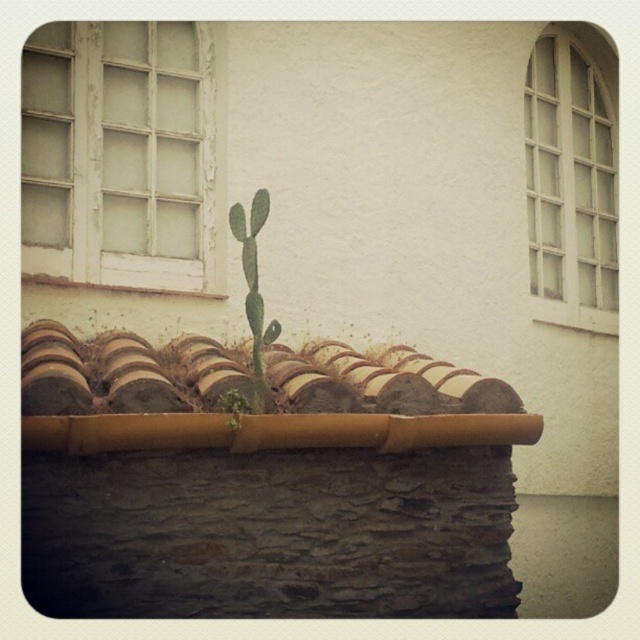
Question: Among these points, which one is farthest from the camera?

Choices:
 (A) (104, 339)
 (B) (257, 230)
 (C) (202, 68)

Answer: (C)

Question: Which of the following is the farthest from the observer?

Choices:
 (A) brown clay tiles at center
 (B) green spiky cactus at center
 (C) white wooden window at upper left
 (D) white wooden grid at upper right

Answer: (D)

Question: Does white wooden window at upper left have a larger size compared to green spiny cactus at center?

Choices:
 (A) no
 (B) yes

Answer: (B)

Question: Which object appears closest to the camera in this image?

Choices:
 (A) green spiny cactus at center
 (B) green spiky cactus at center
 (C) white wooden grid at upper right

Answer: (B)

Question: Where is white wooden grid at upper right located in relation to green spiny cactus at center in the image?

Choices:
 (A) above
 (B) below

Answer: (A)

Question: Is white wooden window at upper left smaller than white wooden grid at upper right?

Choices:
 (A) yes
 (B) no

Answer: (A)